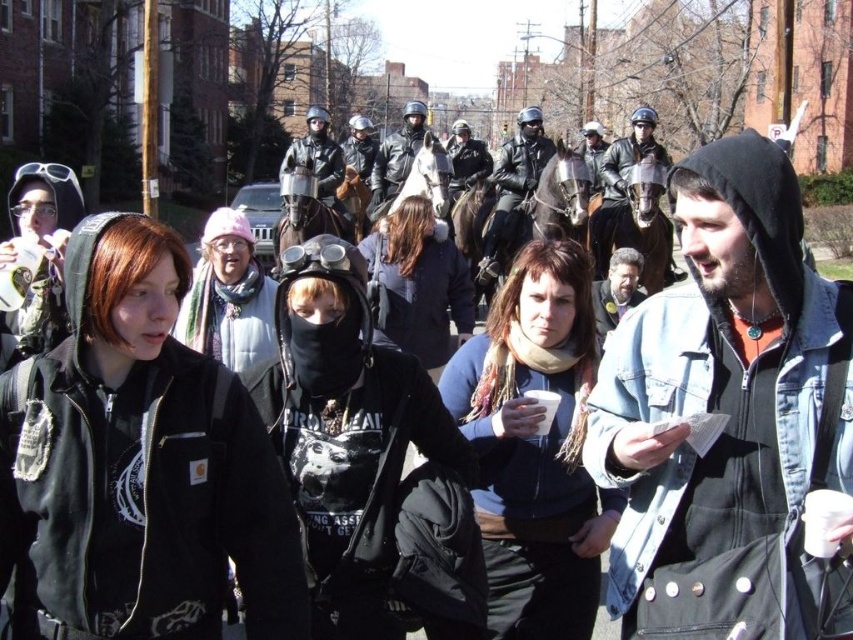
You are a participant in the protest and want to move from the point at coordinates point (622, 204) to the point at coordinates point (636, 256). Given the spatial relationship between these two points, can you safely walk directly towards the second point without going through the first one?

Point (622, 204) is behind point (636, 256), so you can safely walk directly towards point (636, 256) without passing through point (622, 204).

You are a photographer trying to capture a clear shot of both the denim jacket at center and the shiny black leather jacket at center. Since you can only focus on one at a time, which jacket should you focus on to ensure the other is still somewhat in focus?

The denim jacket at center is located below the shiny black leather jacket at center. Since the shiny black leather jacket is higher up, focusing on it would keep the denim jacket in the foreground somewhat in focus.